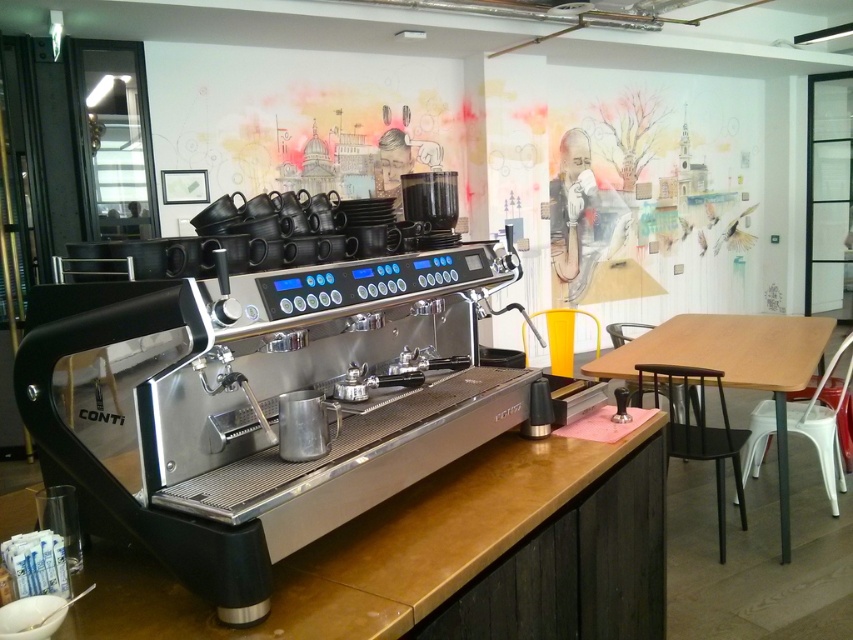
In the scene shown: You are a barista who needs to place a large tray of baked goods on the wooden countertop at center. Considering the space available, will the tray fit if the tray is as wide as the black matte stool at lower right?

The wooden countertop at center has a larger width than the black matte stool at lower right, so the tray should fit comfortably on the wooden countertop at center.

You are a barista who needs to place a large tray of pastries. Which surface can accommodate it better, the wooden countertop at center or the wooden table at right?

The wooden table at right has a greater width than the wooden countertop at center, so it can accommodate the large tray of pastries better.

You are a barista standing at the counter and want to reach the espresso machine controls. The espresso machine controls are located on the wooden countertop at center. Considering your arm can reach 36 inches, can you comfortably reach them?

The wooden countertop at center is 36.57 inches away from the viewer. Since your arm can reach 36 inches, you cannot comfortably reach the espresso machine controls located on the wooden countertop at center as the distance exceeds your arm reach by 0.57 inches.